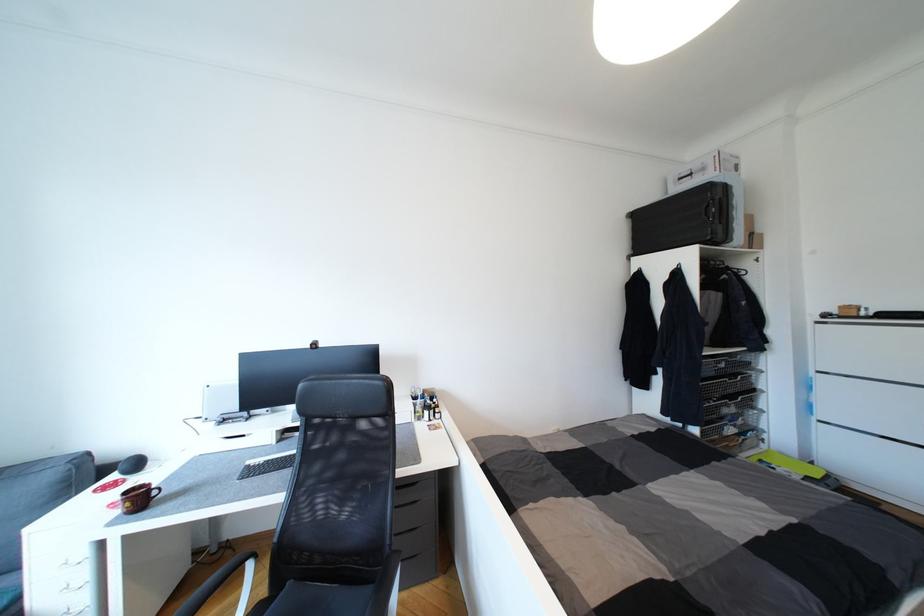
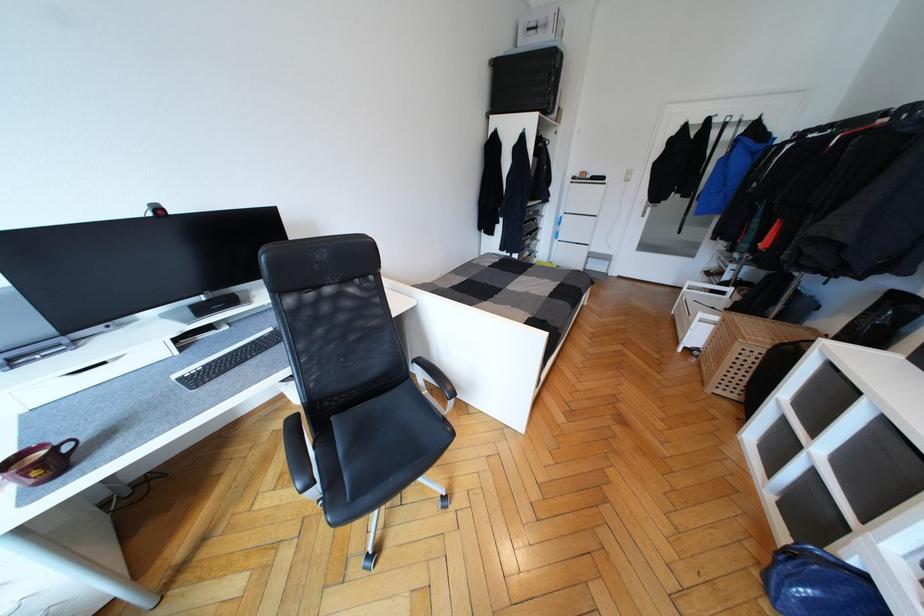
First-person continuous shooting, in which direction is the camera rotating?

The rotation direction of the camera is right-down.